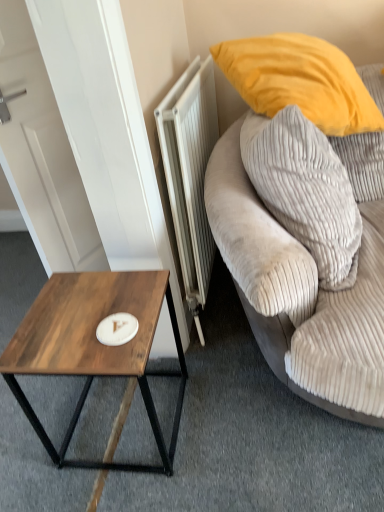
Question: Can we say white metallic radiator at center lies outside white matte plate at center?

Choices:
 (A) no
 (B) yes

Answer: (B)

Question: Is white metallic radiator at center touching white matte plate at center?

Choices:
 (A) yes
 (B) no

Answer: (B)

Question: Is white metallic radiator at center behind white matte plate at center?

Choices:
 (A) yes
 (B) no

Answer: (A)

Question: From a real-world perspective, is white metallic radiator at center under white matte plate at center?

Choices:
 (A) no
 (B) yes

Answer: (B)

Question: Considering the relative sizes of white metallic radiator at center and white matte plate at center in the image provided, is white metallic radiator at center taller than white matte plate at center?

Choices:
 (A) yes
 (B) no

Answer: (A)

Question: Is velvet gray pillow at upper right in front of or behind white matte plate at center in the image?

Choices:
 (A) front
 (B) behind

Answer: (A)

Question: Based on their sizes in the image, would you say velvet gray pillow at upper right is bigger or smaller than white matte plate at center?

Choices:
 (A) big
 (B) small

Answer: (A)

Question: From a real-world perspective, is velvet gray pillow at upper right above or below white matte plate at center?

Choices:
 (A) above
 (B) below

Answer: (A)

Question: Would you say velvet gray pillow at upper right is inside or outside white matte plate at center?

Choices:
 (A) inside
 (B) outside

Answer: (B)

Question: From a real-world perspective, relative to wooden coffee table at lower left, is white metallic radiator at center vertically above or below?

Choices:
 (A) below
 (B) above

Answer: (B)

Question: Considering the relative positions of white metallic radiator at center and wooden coffee table at lower left in the image provided, is white metallic radiator at center to the left or to the right of wooden coffee table at lower left?

Choices:
 (A) right
 (B) left

Answer: (A)

Question: Is white metallic radiator at center bigger or smaller than wooden coffee table at lower left?

Choices:
 (A) big
 (B) small

Answer: (A)

Question: Considering the positions of point (200, 75) and point (119, 373), is point (200, 75) closer or farther from the camera than point (119, 373)?

Choices:
 (A) farther
 (B) closer

Answer: (A)

Question: Is point (178, 122) closer or farther from the camera than point (369, 170)?

Choices:
 (A) farther
 (B) closer

Answer: (B)

Question: From the image's perspective, is white metallic radiator at center positioned above or below velvet grey couch at right?

Choices:
 (A) above
 (B) below

Answer: (A)